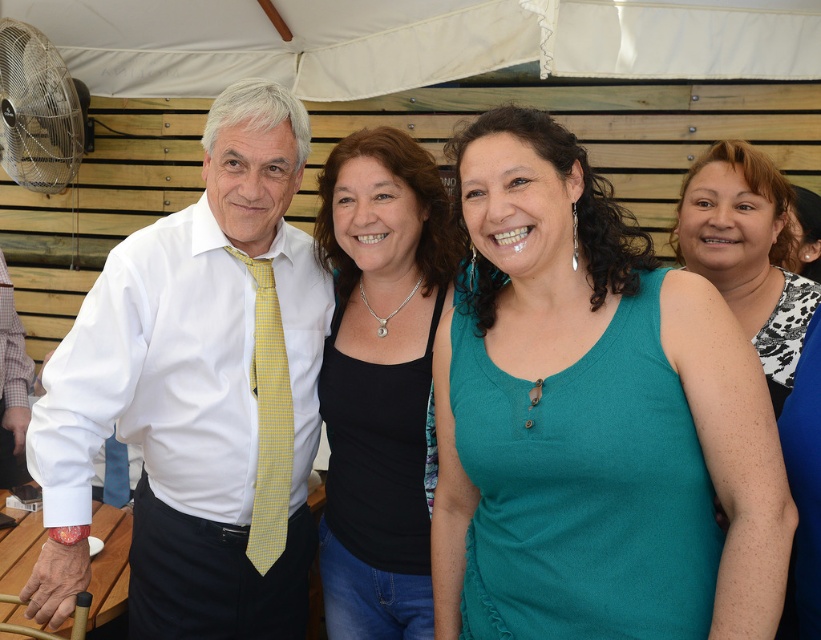
Consider the image. Can you confirm if white fabric canopy at upper center is wider than yellowtexturetie at left?

Correct, the width of white fabric canopy at upper center exceeds that of yellowtexturetie at left.

Which of these two, white fabric canopy at upper center or yellowtexturetie at left, stands taller?

With more height is yellowtexturetie at left.

Measure the distance between point (99, 67) and camera.

The distance of point (99, 67) from camera is 3.37 meters.

Locate an element on the screen. white fabric canopy at upper center is located at coordinates 416,42.

Is white fabric canopy at upper center smaller than teal fabric tank top at right?

Actually, white fabric canopy at upper center might be larger than teal fabric tank top at right.

Does white fabric canopy at upper center come behind teal fabric tank top at right?

Yes.

Is point (138, 65) closer to viewer compared to point (801, 316)?

No.

Where is `white fabric canopy at upper center`? The height and width of the screenshot is (640, 821). white fabric canopy at upper center is located at coordinates (416, 42).

Can you confirm if black matte tank top at center is bigger than yellowtexturetie at left?

Yes.

The width and height of the screenshot is (821, 640). What are the coordinates of `black matte tank top at center` in the screenshot? It's located at (379, 378).